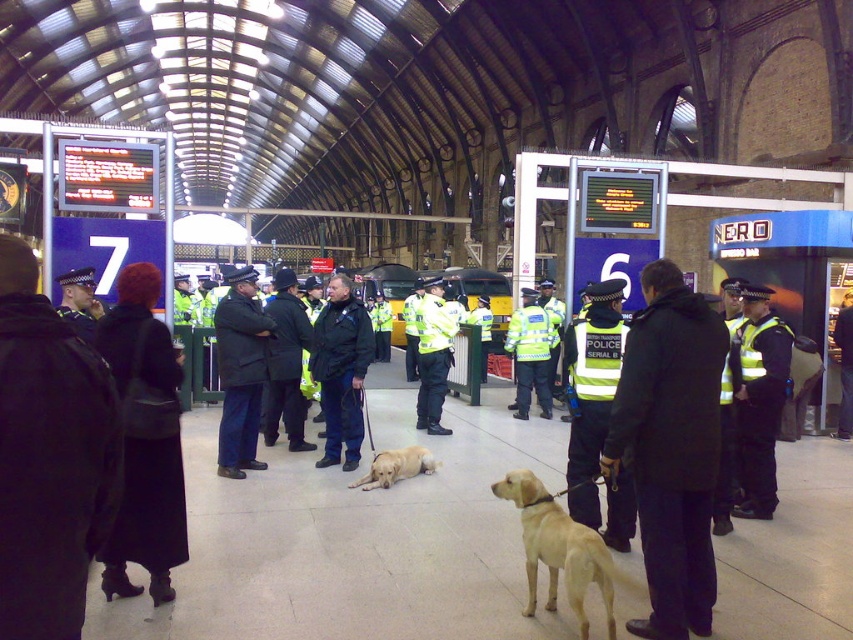
You are a photographer standing in the train station and want to take a photo of the dark blue coat at center and the yellow reflective uniform at center. Which one appears shorter in the photo?

The dark blue coat at center appears shorter in the photo compared to the yellow reflective uniform at center because it has a lesser height.

You are standing at the entrance of the train station and want to locate the dark blue coat at center. According to the coordinates provided, in which direction should you look to find it?

The dark blue coat at center is located at point coordinates, so you should look towards the center area of the image to find it.

You are standing in the train station and need to reach the exit located at point [527,321]. There is an obstacle at point [692,360]. Which point should you avoid to safely navigate towards the exit?

You should avoid point [692,360] because it is closer to you and might block your path to the exit at [527,321].